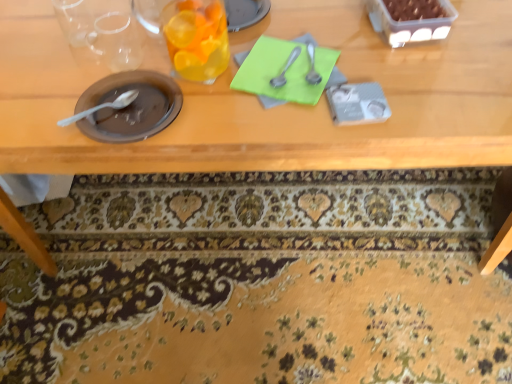
Find the location of a particular element. The height and width of the screenshot is (384, 512). vacant area on top of floral carpet at lower center (from a real-world perspective) is located at coordinates (153, 273).